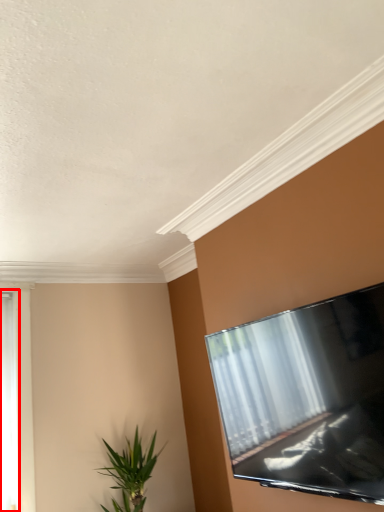
Question: Where is window (annotated by the red box) located in relation to houseplant in the image?

Choices:
 (A) left
 (B) right

Answer: (A)